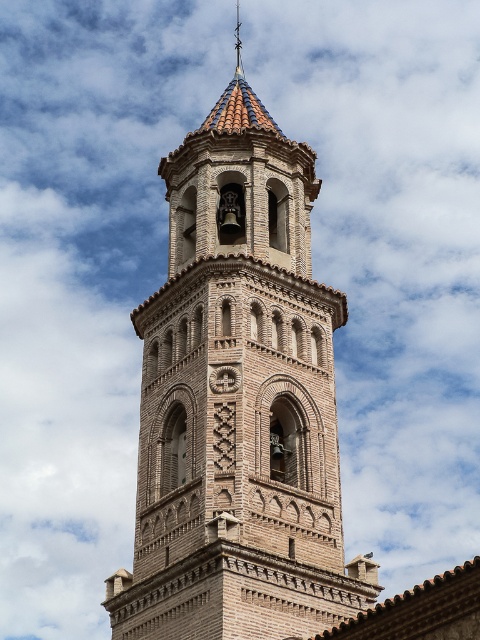
Who is more forward, (x=300, y=576) or (x=236, y=40)?

Point (x=300, y=576) is in front.

Identify the location of brown brick tower at center. (238, 403).